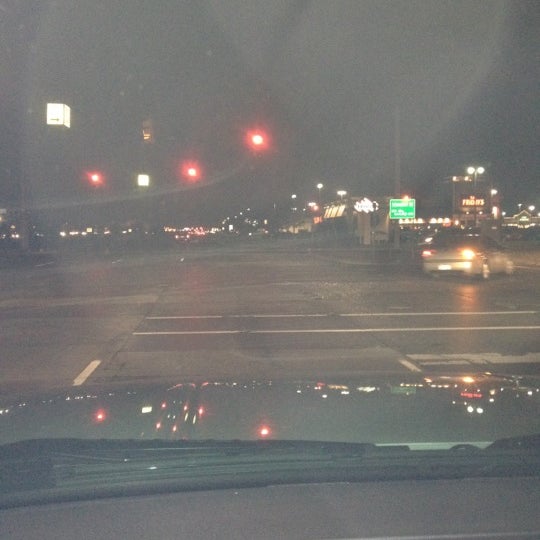
Locate an element on the screen. hotel is located at coordinates (368, 209).